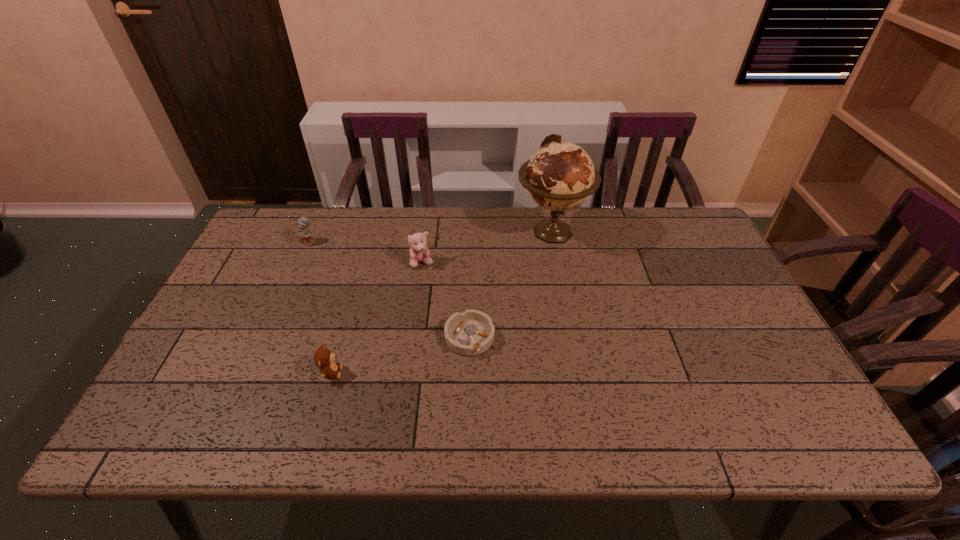
The width and height of the screenshot is (960, 540). In the image, there is a desktop. Identify the location of vacant area at the near edge. (717, 414).

Locate an element on the screen. The image size is (960, 540). blank area at the left edge is located at coordinates (248, 333).

In the image, there is a desktop. Find the location of `vacant space at the right edge`. vacant space at the right edge is located at coordinates (733, 349).

At what (x,y) coordinates should I click in order to perform the action: click on free region at the far left corner of the desktop. Please return your answer as a coordinate pair (x, y). Looking at the image, I should click on (275, 218).

Find the location of a particular element. free space at the far right corner of the desktop is located at coordinates (650, 207).

Find the location of a particular element. free spot between the tallest object and the farthest teddy bear is located at coordinates (430, 237).

You are a GUI agent. You are given a task and a screenshot of the screen. Output one action in this format:
    pyautogui.click(x=<x>, y=<y>)
    Task: Click on the vacant space in between the second teddy bear from right to left and the leftmost teddy bear
    
    Given the screenshot: What is the action you would take?
    pyautogui.click(x=321, y=307)

What are the coordinates of `free spot between the leftmost object and the second object from left to right` in the screenshot? It's located at (321, 307).

Locate an element on the screen. empty space between the second tallest object and the farthest teddy bear is located at coordinates (366, 253).

Identify the location of vacant space that is in between the second nearest teddy bear and the leftmost teddy bear. (366, 253).